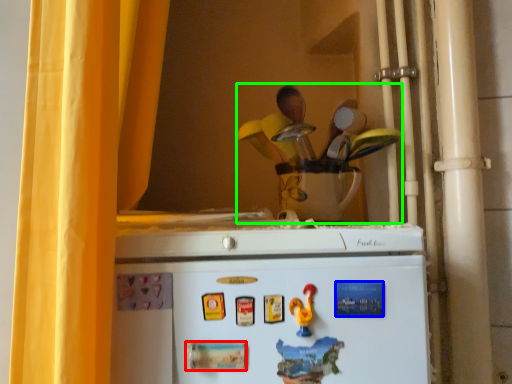
Question: Estimate the real-world distances between objects in this image. Which object is closer to magnet (highlighted by a red box), magnet (highlighted by a blue box) or toy (highlighted by a green box)?

Choices:
 (A) magnet
 (B) toy

Answer: (A)